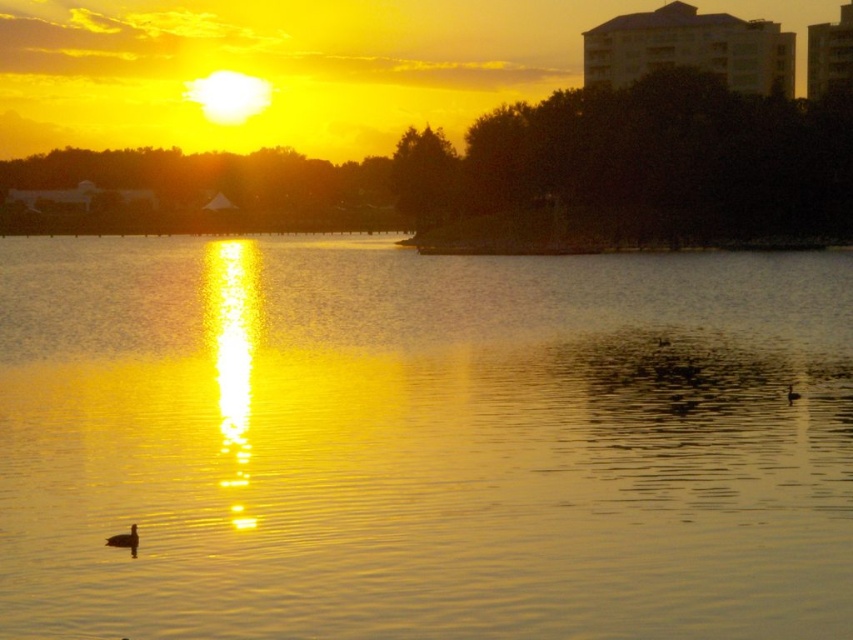
Question: Is golden reflective water at center behind brown matte bird at lower right?

Choices:
 (A) no
 (B) yes

Answer: (A)

Question: Among these points, which one is farthest from the camera?

Choices:
 (A) (488, 429)
 (B) (793, 394)
 (C) (108, 536)

Answer: (B)

Question: Does golden reflective water at center appear on the left side of brown matte bird at lower right?

Choices:
 (A) no
 (B) yes

Answer: (B)

Question: Which object is farther from the camera taking this photo?

Choices:
 (A) brown matte bird at lower right
 (B) golden reflective water at center
 (C) dark brown duck at lower left

Answer: (A)

Question: Does dark brown duck at lower left appear over brown matte bird at lower right?

Choices:
 (A) yes
 (B) no

Answer: (B)

Question: Which of the following is the farthest from the observer?

Choices:
 (A) golden reflective water at center
 (B) brown matte bird at lower right
 (C) dark brown duck at lower left

Answer: (B)